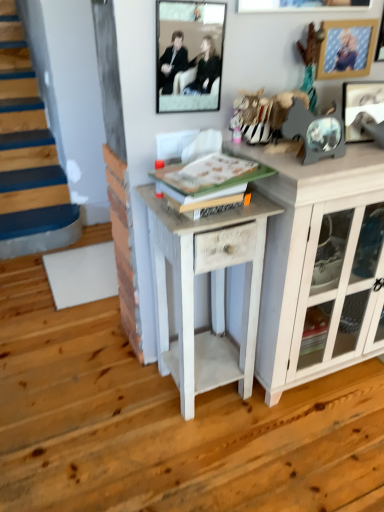
Question: Is wooden picture frame at upper right, acting as the second picture frame starting from the left, wider than metallic silver picture frame at upper right, the 3th picture frame when ordered from left to right?

Choices:
 (A) no
 (B) yes

Answer: (A)

Question: From the image's perspective, does wooden picture frame at upper right, the second picture frame when ordered from right to left, appear higher than metallic silver picture frame at upper right, the 3th picture frame when ordered from left to right?

Choices:
 (A) no
 (B) yes

Answer: (B)

Question: Is wooden picture frame at upper right, the second picture frame when ordered from right to left, touching metallic silver picture frame at upper right, the 3th picture frame when ordered from left to right?

Choices:
 (A) yes
 (B) no

Answer: (B)

Question: From a real-world perspective, is wooden picture frame at upper right, acting as the second picture frame starting from the left, positioned under metallic silver picture frame at upper right, positioned as the 1th picture frame in right-to-left order, based on gravity?

Choices:
 (A) no
 (B) yes

Answer: (A)

Question: Is wooden picture frame at upper right, acting as the second picture frame starting from the left, turned away from metallic silver picture frame at upper right, positioned as the 1th picture frame in right-to-left order?

Choices:
 (A) no
 (B) yes

Answer: (A)

Question: From the image's perspective, relative to wooden picture frame at upper right, the second picture frame when ordered from right to left, is white painted wood side table at center above or below?

Choices:
 (A) above
 (B) below

Answer: (B)

Question: Choose the correct answer: Is white painted wood side table at center inside wooden picture frame at upper right, the second picture frame when ordered from right to left, or outside it?

Choices:
 (A) outside
 (B) inside

Answer: (A)

Question: In terms of width, does white painted wood side table at center look wider or thinner when compared to wooden picture frame at upper right, acting as the second picture frame starting from the left?

Choices:
 (A) wide
 (B) thin

Answer: (A)

Question: From a real-world perspective, relative to wooden picture frame at upper right, the second picture frame when ordered from right to left, is white painted wood side table at center vertically above or below?

Choices:
 (A) above
 (B) below

Answer: (B)

Question: Considering the positions of point (249, 362) and point (220, 74), is point (249, 362) closer or farther from the camera than point (220, 74)?

Choices:
 (A) farther
 (B) closer

Answer: (A)

Question: Would you say white painted wood side table at center is inside or outside matte black frame at upper center, positioned as the 1th picture frame in left-to-right order?

Choices:
 (A) inside
 (B) outside

Answer: (B)

Question: In the image, is white painted wood side table at center positioned in front of or behind matte black frame at upper center, positioned as the 1th picture frame in left-to-right order?

Choices:
 (A) front
 (B) behind

Answer: (A)

Question: Is white painted wood side table at center bigger or smaller than matte black frame at upper center, positioned as the 1th picture frame in left-to-right order?

Choices:
 (A) big
 (B) small

Answer: (A)

Question: Do you think metallic silver picture frame at upper right, the 3th picture frame when ordered from left to right, is within white painted wood side table at center, or outside of it?

Choices:
 (A) inside
 (B) outside

Answer: (B)

Question: Is point (352, 113) positioned closer to the camera than point (223, 241)?

Choices:
 (A) farther
 (B) closer

Answer: (A)